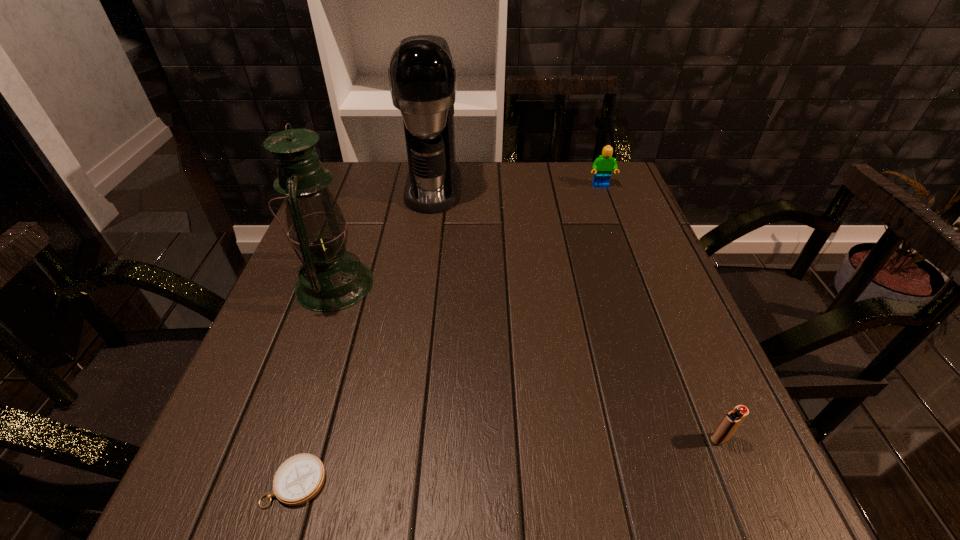
Image resolution: width=960 pixels, height=540 pixels. What are the coordinates of `vacant region between the third nearest object and the nearest object` in the screenshot? It's located at (315, 383).

This screenshot has height=540, width=960. I want to click on empty space between the igniter and the oil lamp, so click(527, 362).

At what (x,y) coordinates should I click in order to perform the action: click on free space that is in between the Lego and the oil lamp. Please return your answer as a coordinate pair (x, y). The image size is (960, 540). Looking at the image, I should click on (468, 235).

Where is `vacant region between the second shortest object and the nearest object`? The width and height of the screenshot is (960, 540). vacant region between the second shortest object and the nearest object is located at coordinates (508, 461).

Identify the location of vacant space that's between the igniter and the third nearest object. (527, 362).

Where is `empty location between the third farthest object and the third shortest object`? Image resolution: width=960 pixels, height=540 pixels. empty location between the third farthest object and the third shortest object is located at coordinates (468, 235).

Identify the location of free space between the fourth farthest object and the nearest object. (508, 461).

Where is `free spot between the third farthest object and the coffee maker`? This screenshot has height=540, width=960. free spot between the third farthest object and the coffee maker is located at coordinates tap(384, 236).

At what (x,y) coordinates should I click in order to perform the action: click on the fourth closest object to the shortest object. Please return your answer as a coordinate pair (x, y). The image size is (960, 540). Looking at the image, I should click on (603, 166).

Select which object appears as the fourth closest to the third shortest object. Please provide its 2D coordinates. Your answer should be formatted as a tuple, i.e. [(x, y)], where the tuple contains the x and y coordinates of a point satisfying the conditions above.

[(299, 479)]